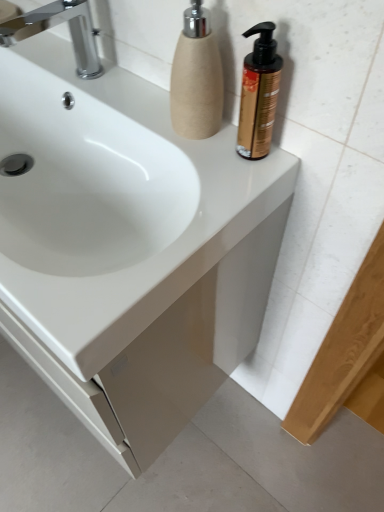
Question: From a real-world perspective, is beige textured soap dispenser at upper right, marked as the 2th soap dispenser in a right-to-left arrangement, positioned under white glossy sink at center based on gravity?

Choices:
 (A) no
 (B) yes

Answer: (A)

Question: Can you confirm if beige textured soap dispenser at upper right, marked as the 2th soap dispenser in a right-to-left arrangement, is thinner than white glossy sink at center?

Choices:
 (A) yes
 (B) no

Answer: (A)

Question: Is beige textured soap dispenser at upper right, which is the first soap dispenser in left-to-right order, wider than white glossy sink at center?

Choices:
 (A) no
 (B) yes

Answer: (A)

Question: From a real-world perspective, is beige textured soap dispenser at upper right, which is the first soap dispenser in left-to-right order, on white glossy sink at center?

Choices:
 (A) yes
 (B) no

Answer: (A)

Question: Is beige textured soap dispenser at upper right, which is the first soap dispenser in left-to-right order, outside white glossy sink at center?

Choices:
 (A) yes
 (B) no

Answer: (A)

Question: Does beige textured soap dispenser at upper right, marked as the 2th soap dispenser in a right-to-left arrangement, have a larger size compared to white glossy sink at center?

Choices:
 (A) yes
 (B) no

Answer: (B)

Question: Are chrome metallic faucet at upper left and gold metallic pump bottle at upper right, the 2th soap dispenser from the left, located far from each other?

Choices:
 (A) yes
 (B) no

Answer: (B)

Question: Is chrome metallic faucet at upper left oriented towards gold metallic pump bottle at upper right, the first soap dispenser in the right-to-left sequence?

Choices:
 (A) yes
 (B) no

Answer: (B)

Question: Is chrome metallic faucet at upper left taller than gold metallic pump bottle at upper right, the 2th soap dispenser from the left?

Choices:
 (A) no
 (B) yes

Answer: (A)

Question: From a real-world perspective, does chrome metallic faucet at upper left stand above gold metallic pump bottle at upper right, the first soap dispenser in the right-to-left sequence?

Choices:
 (A) no
 (B) yes

Answer: (A)

Question: Does chrome metallic faucet at upper left appear on the right side of gold metallic pump bottle at upper right, the 2th soap dispenser from the left?

Choices:
 (A) no
 (B) yes

Answer: (A)

Question: Is the surface of chrome metallic faucet at upper left in direct contact with gold metallic pump bottle at upper right, the 2th soap dispenser from the left?

Choices:
 (A) yes
 (B) no

Answer: (B)

Question: Is chrome metallic faucet at upper left bigger than beige textured soap dispenser at upper right, which is the first soap dispenser in left-to-right order?

Choices:
 (A) no
 (B) yes

Answer: (B)